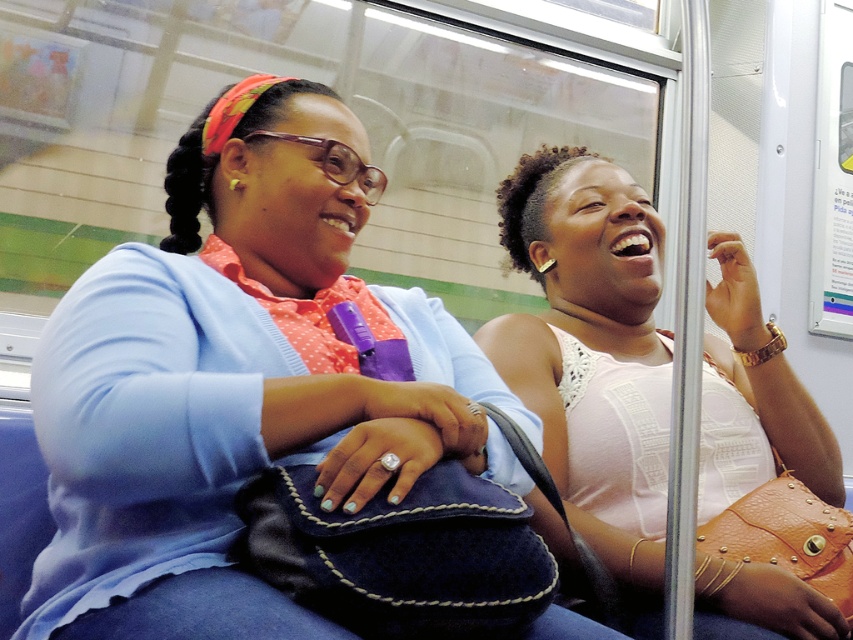
Question: Does matte blue sweater at center appear on the right side of pink lace top at right?

Choices:
 (A) no
 (B) yes

Answer: (A)

Question: Which point is closer to the camera?

Choices:
 (A) (625, 272)
 (B) (376, 330)

Answer: (B)

Question: Is matte blue sweater at center smaller than pink lace top at right?

Choices:
 (A) yes
 (B) no

Answer: (B)

Question: Which point is farther to the camera?

Choices:
 (A) (819, 422)
 (B) (169, 166)

Answer: (A)

Question: Which object is farther from the camera taking this photo?

Choices:
 (A) matte blue sweater at center
 (B) pink lace top at right

Answer: (B)

Question: In this image, where is matte blue sweater at center located relative to pink lace top at right?

Choices:
 (A) left
 (B) right

Answer: (A)